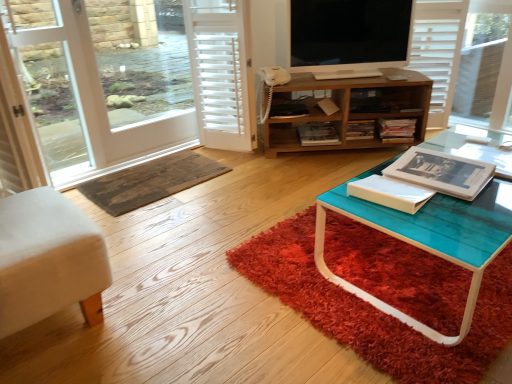
Question: Is transparent glass screen door at left thinner than wooden cabinet at center?

Choices:
 (A) yes
 (B) no

Answer: (A)

Question: Can you confirm if transparent glass screen door at left is smaller than wooden cabinet at center?

Choices:
 (A) no
 (B) yes

Answer: (B)

Question: From the image's perspective, is transparent glass screen door at left under wooden cabinet at center?

Choices:
 (A) yes
 (B) no

Answer: (A)

Question: From a real-world perspective, is transparent glass screen door at left located beneath wooden cabinet at center?

Choices:
 (A) no
 (B) yes

Answer: (A)

Question: Does transparent glass screen door at left have a greater height compared to wooden cabinet at center?

Choices:
 (A) no
 (B) yes

Answer: (B)

Question: Looking at their shapes, would you say wooden textured doormat at center, which is the second doormat in front-to-back order, is wider or thinner than wooden cabinet at center?

Choices:
 (A) wide
 (B) thin

Answer: (A)

Question: Is wooden textured doormat at center, the second doormat when ordered from right to left, bigger or smaller than wooden cabinet at center?

Choices:
 (A) big
 (B) small

Answer: (B)

Question: Choose the correct answer: Is wooden textured doormat at center, marked as the first doormat in a left-to-right arrangement, inside wooden cabinet at center or outside it?

Choices:
 (A) inside
 (B) outside

Answer: (B)

Question: From a real-world perspective, is wooden textured doormat at center, the second doormat when ordered from right to left, above or below wooden cabinet at center?

Choices:
 (A) below
 (B) above

Answer: (A)

Question: Is transparent glass screen door at left situated inside wooden cabinet at center or outside?

Choices:
 (A) inside
 (B) outside

Answer: (B)

Question: From the image's perspective, is transparent glass screen door at left located above or below wooden cabinet at center?

Choices:
 (A) below
 (B) above

Answer: (A)

Question: In terms of width, does transparent glass screen door at left look wider or thinner when compared to wooden cabinet at center?

Choices:
 (A) wide
 (B) thin

Answer: (B)

Question: Based on their sizes in the image, would you say transparent glass screen door at left is bigger or smaller than wooden cabinet at center?

Choices:
 (A) big
 (B) small

Answer: (B)

Question: In the image, is black glossy tv at upper center positioned in front of or behind shaggy red rug at lower center, the first doormat positioned from the right?

Choices:
 (A) behind
 (B) front

Answer: (A)

Question: In terms of height, does black glossy tv at upper center look taller or shorter compared to shaggy red rug at lower center, marked as the first doormat in a front-to-back arrangement?

Choices:
 (A) tall
 (B) short

Answer: (A)